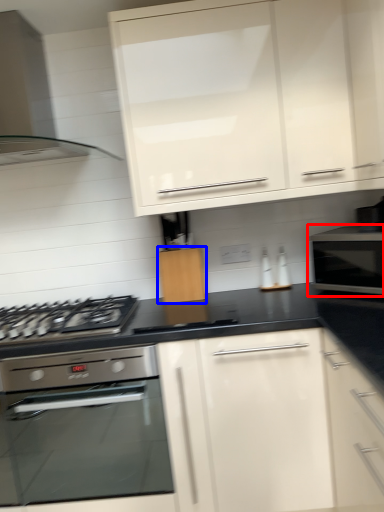
Question: Which point is closer to the camera, microwave oven (highlighted by a red box) or cabinetry (highlighted by a blue box)?

Choices:
 (A) microwave oven
 (B) cabinetry

Answer: (A)